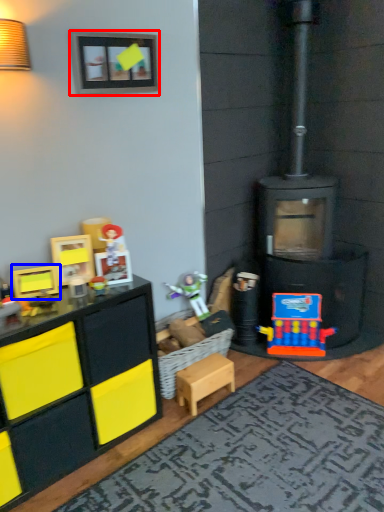
Question: Which of the following is the farthest to the observer, picture frame (highlighted by a red box) or toy (highlighted by a blue box)?

Choices:
 (A) picture frame
 (B) toy

Answer: (A)